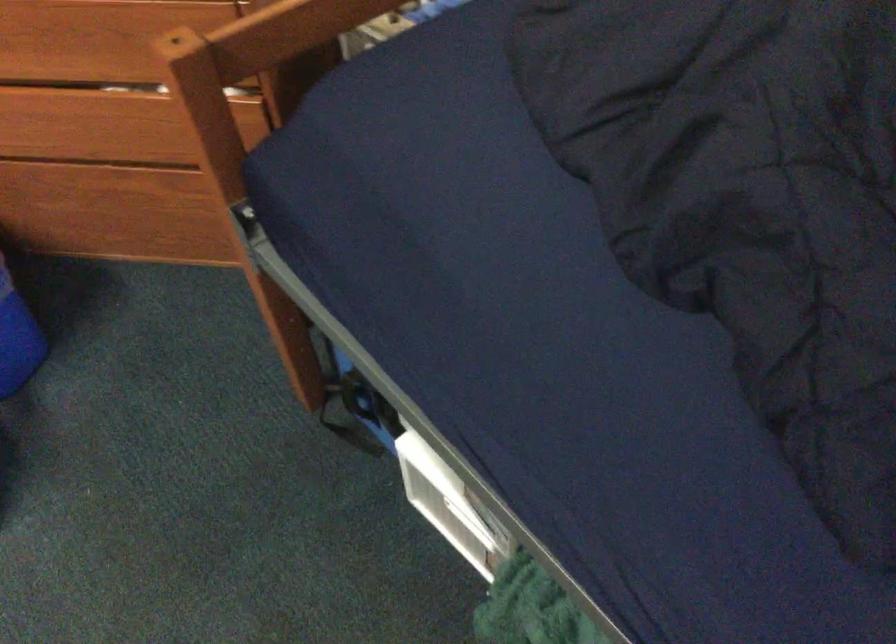
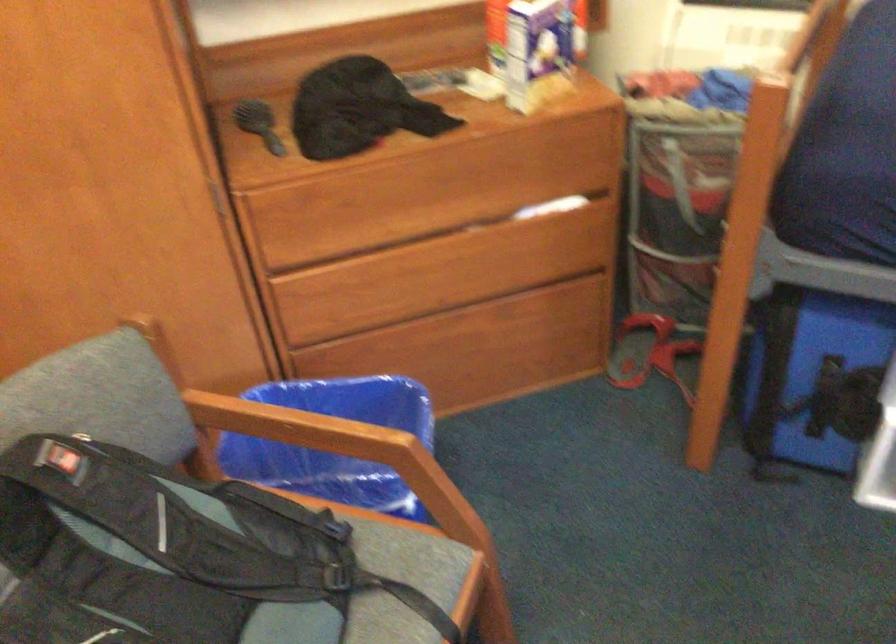
Locate, in the second image, the point that corresponds to (x=69, y=80) in the first image.

(420, 238)